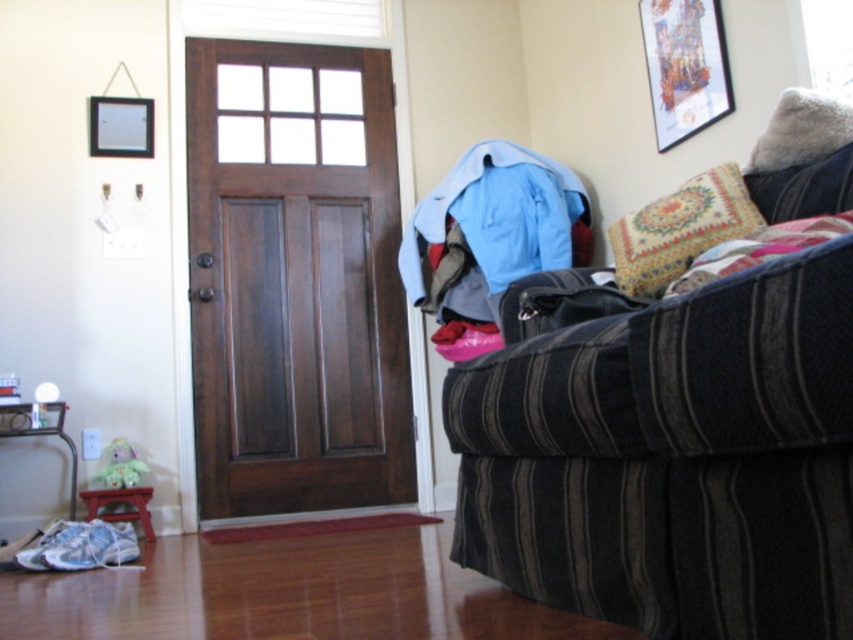
Is striped fabric couch at right below dark wood door at center?

Yes.

The image size is (853, 640). What do you see at coordinates (672, 460) in the screenshot? I see `striped fabric couch at right` at bounding box center [672, 460].

Where is `striped fabric couch at right`? striped fabric couch at right is located at coordinates (x=672, y=460).

The image size is (853, 640). What are the coordinates of `striped fabric couch at right` in the screenshot? It's located at (672, 460).

Is point (569, 467) positioned after point (630, 280)?

No, it is in front of (630, 280).

Can you confirm if striped fabric couch at right is positioned to the right of patterned fabric pillow at right?

In fact, striped fabric couch at right is to the left of patterned fabric pillow at right.

Who is more forward, (772, 592) or (671, 202)?

Point (772, 592) is in front.

Locate an element on the screen. The height and width of the screenshot is (640, 853). striped fabric couch at right is located at coordinates (672, 460).

From the picture: Is striped fabric couch at right behind wooden picture frame at upper right?

No.

Is striped fabric couch at right below wooden picture frame at upper right?

Yes.

Is point (486, 376) farther from camera compared to point (711, 49)?

No, (486, 376) is in front of (711, 49).

The width and height of the screenshot is (853, 640). I want to click on striped fabric couch at right, so click(x=672, y=460).